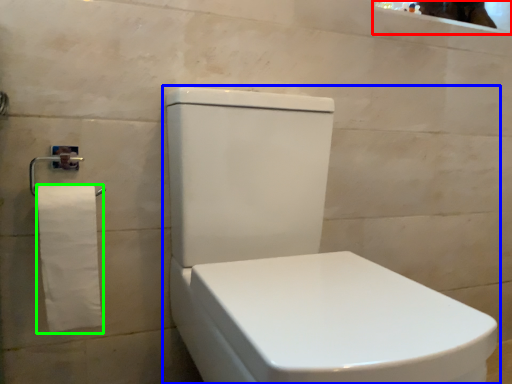
Question: Which object is positioned closest to mirror (highlighted by a red box)? Select from toilet (highlighted by a blue box) and toilet paper (highlighted by a green box).

Choices:
 (A) toilet
 (B) toilet paper

Answer: (A)